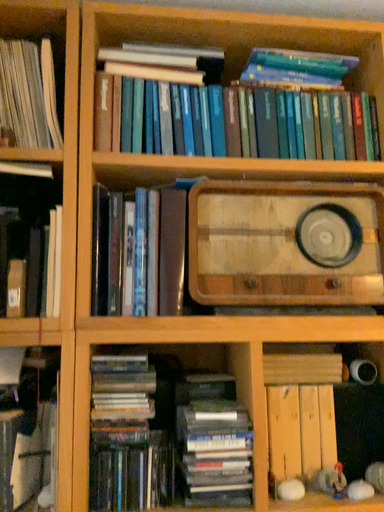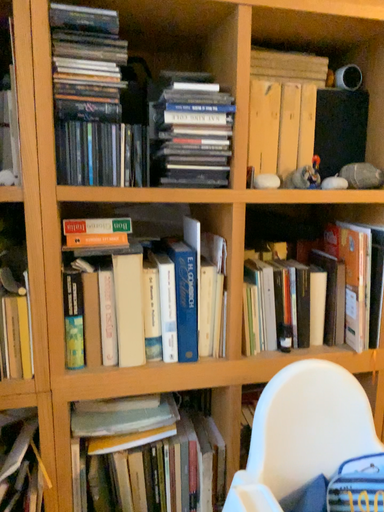
Question: Which way did the camera rotate in the video?

Choices:
 (A) rotated left
 (B) rotated right

Answer: (B)